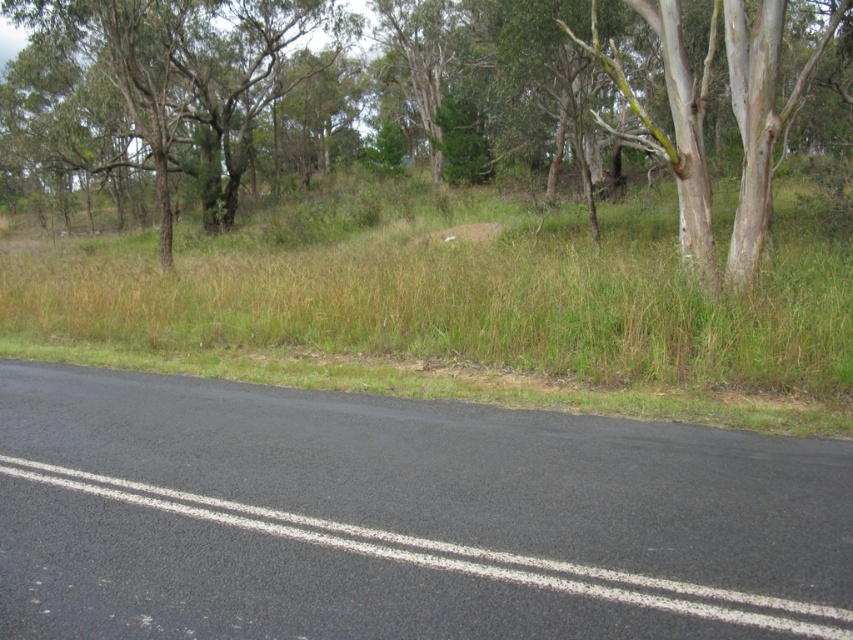
Which is more to the right, green grass at center or green leafy tree at upper center?

Positioned to the right is green leafy tree at upper center.

Who is more forward, (x=259, y=360) or (x=732, y=100)?

Point (x=259, y=360)

Image resolution: width=853 pixels, height=640 pixels. Identify the location of green grass at center. (465, 314).

Who is higher up, green grass at center or green rough bark tree at upper left?

green rough bark tree at upper left is above.

How distant is green grass at center from green rough bark tree at upper left?

A distance of 42.69 feet exists between green grass at center and green rough bark tree at upper left.

Is point (299, 333) positioned before point (202, 52)?

That is True.

I want to click on green grass at center, so click(x=465, y=314).

Which of these two, green rough bark tree at upper left or green leafy tree at upper center, stands shorter?

Standing shorter between the two is green leafy tree at upper center.

Who is more distant from viewer, (244, 60) or (757, 196)?

Point (244, 60)

Where is `green rough bark tree at upper left`? The height and width of the screenshot is (640, 853). green rough bark tree at upper left is located at coordinates (173, 84).